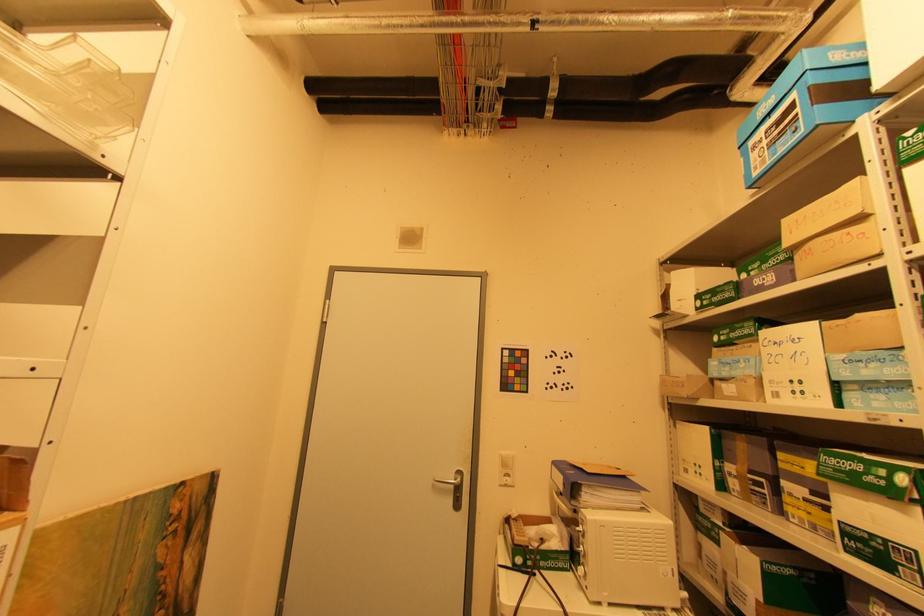
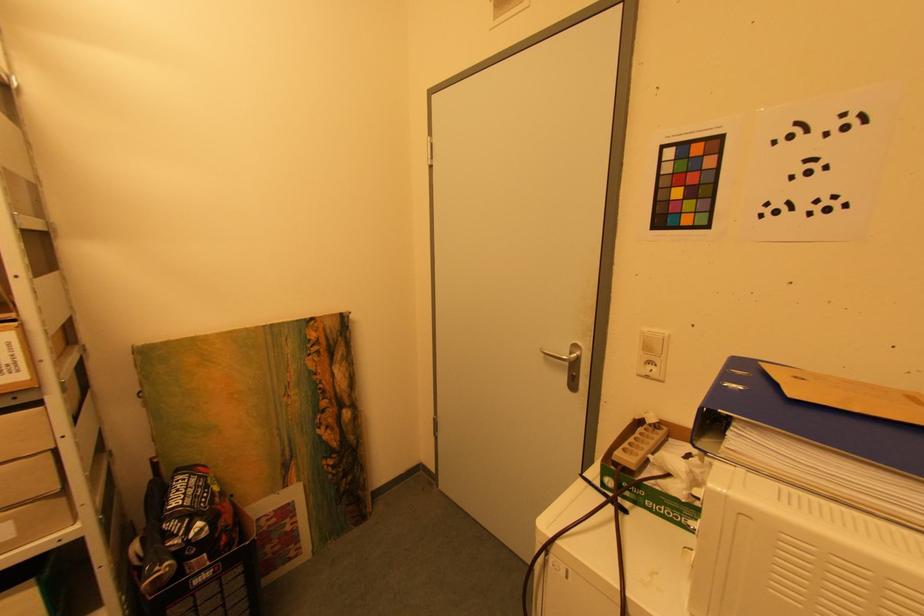
First-person continuous shooting, in which direction is the camera rotating?

The camera's rotation is toward left-down.